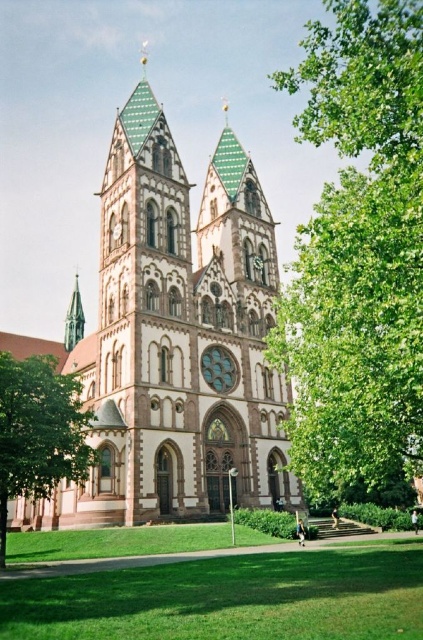
Question: Can you confirm if white stone church at center is positioned below green leafy tree at right?

Choices:
 (A) no
 (B) yes

Answer: (B)

Question: Which point is farther from the camera taking this photo?

Choices:
 (A) (379, 314)
 (B) (252, 237)
 (C) (79, 476)
 (D) (79, 328)

Answer: (D)

Question: Is white stone church at center positioned in front of green leafy tree at right?

Choices:
 (A) yes
 (B) no

Answer: (B)

Question: Which object appears closest to the camera in this image?

Choices:
 (A) green leafy tree at lower left
 (B) white stone church at center
 (C) green leafy tree at right

Answer: (C)

Question: Which point appears farthest from the camera in this image?

Choices:
 (A) (68, 326)
 (B) (316, 346)
 (C) (260, 456)

Answer: (A)

Question: Can you confirm if white stone church at center is smaller than green leafy tree at lower left?

Choices:
 (A) yes
 (B) no

Answer: (B)